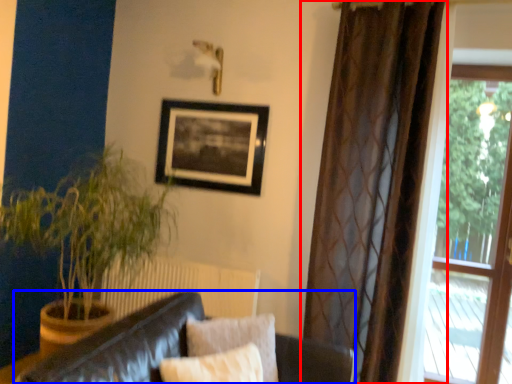
Question: Among these objects, which one is nearest to the camera, curtain (highlighted by a red box) or studio couch (highlighted by a blue box)?

Choices:
 (A) curtain
 (B) studio couch

Answer: (B)